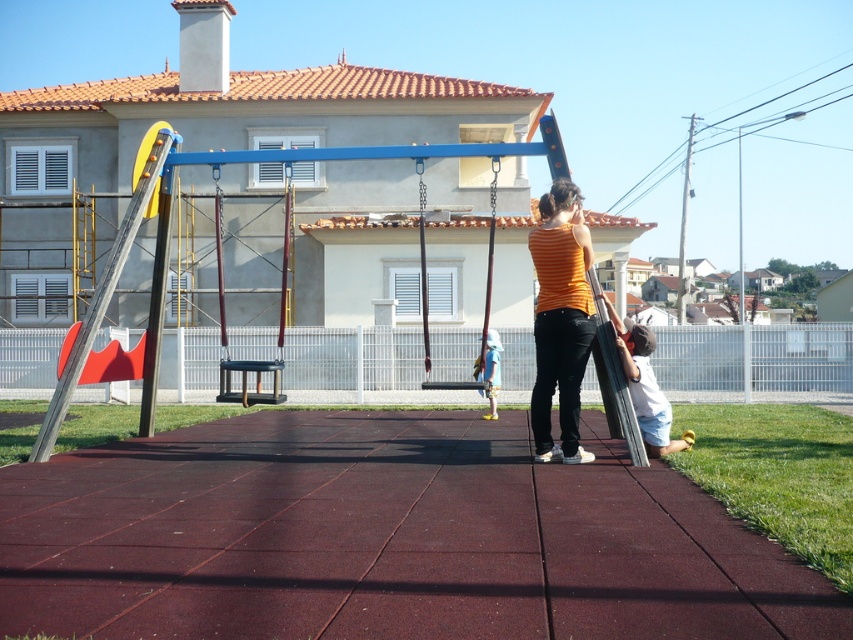
Question: Does burgundy rubber mat at center have a smaller size compared to blue denim shorts at center?

Choices:
 (A) no
 (B) yes

Answer: (B)

Question: Which of these objects is positioned closest to the brown leather swing at center?

Choices:
 (A) orange matte tank top at center
 (B) burgundy rubber mat at center
 (C) light blue denim shorts at center

Answer: (C)

Question: Considering the real-world distances, which object is farthest from the brown leather swing at center?

Choices:
 (A) burgundy rubber mat at center
 (B) light blue denim shorts at center
 (C) blue denim shorts at center
 (D) orange matte tank top at center

Answer: (A)

Question: Is orange matte tank top at center positioned before brown leather swing at center?

Choices:
 (A) no
 (B) yes

Answer: (B)

Question: Which point is closer to the camera taking this photo?

Choices:
 (A) (537, 444)
 (B) (194, 536)

Answer: (B)

Question: Does orange matte tank top at center have a smaller size compared to blue denim shorts at center?

Choices:
 (A) yes
 (B) no

Answer: (A)